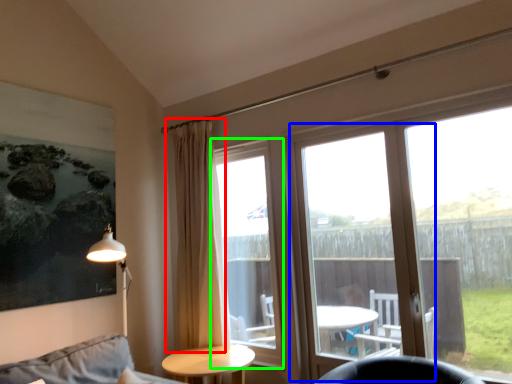
Question: Considering the real-world distances, which object is closest to curtain (highlighted by a red box)? screen door (highlighted by a blue box) or bay window (highlighted by a green box).

Choices:
 (A) screen door
 (B) bay window

Answer: (B)